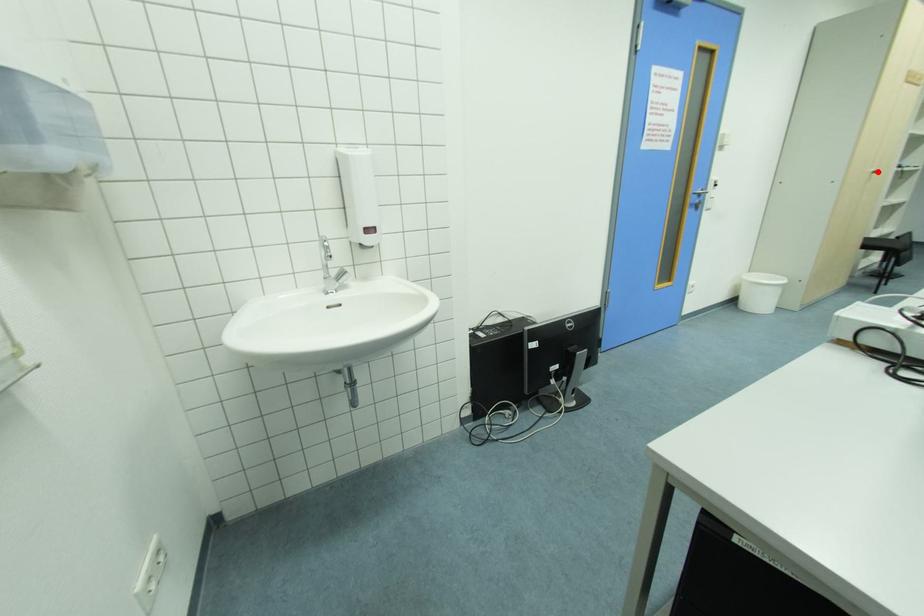
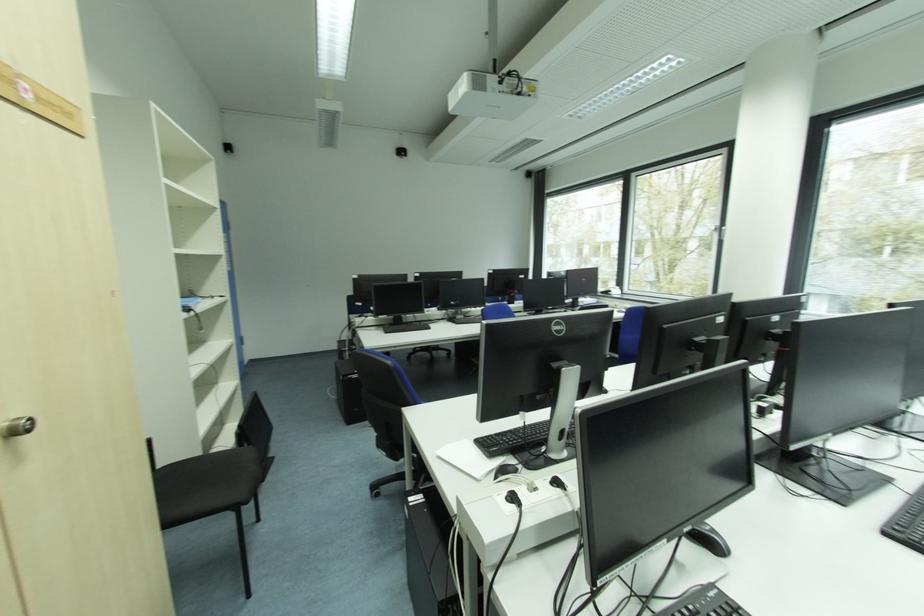
Find the pixel in the second image that matches the highlighted location in the first image.

(6, 424)